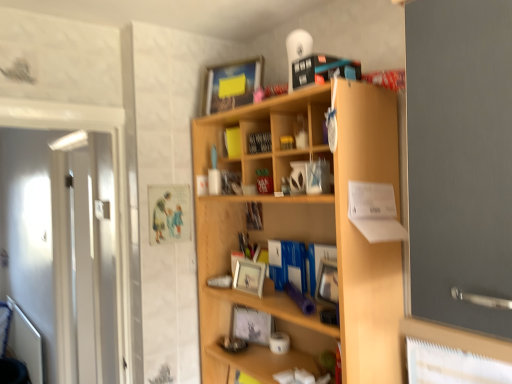
Question: Considering the relative sizes of white glossy door at left and yellow matte book at upper center, marked as the first book in a top-to-bottom arrangement, in the image provided, is white glossy door at left shorter than yellow matte book at upper center, marked as the first book in a top-to-bottom arrangement,?

Choices:
 (A) yes
 (B) no

Answer: (B)

Question: Is white glossy door at left at the right side of yellow matte book at upper center, which appears as the 2th book when viewed from the back?

Choices:
 (A) yes
 (B) no

Answer: (B)

Question: Considering the relative sizes of white glossy door at left and yellow matte book at upper center, the third book positioned from the bottom, in the image provided, is white glossy door at left smaller than yellow matte book at upper center, the third book positioned from the bottom,?

Choices:
 (A) yes
 (B) no

Answer: (B)

Question: Is white glossy door at left further to camera compared to yellow matte book at upper center, which appears as the 2th book when viewed from the back?

Choices:
 (A) yes
 (B) no

Answer: (B)

Question: From a real-world perspective, is white glossy door at left on top of yellow matte book at upper center, arranged as the second book when viewed from the front?

Choices:
 (A) no
 (B) yes

Answer: (A)

Question: Is matte wooden picture frame at upper center, the first picture frame positioned from the top, to the left or to the right of matte silver picture frame at center, which appears as the second picture frame when ordered from the bottom, in the image?

Choices:
 (A) left
 (B) right

Answer: (A)

Question: Looking at their shapes, would you say matte wooden picture frame at upper center, which is counted as the 3th picture frame, starting from the bottom, is wider or thinner than matte silver picture frame at center, which appears as the second picture frame when ordered from the bottom?

Choices:
 (A) wide
 (B) thin

Answer: (B)

Question: From a real-world perspective, relative to matte silver picture frame at center, which appears as the second picture frame when ordered from the bottom, is matte wooden picture frame at upper center, which is counted as the 3th picture frame, starting from the bottom, vertically above or below?

Choices:
 (A) below
 (B) above

Answer: (B)

Question: Is matte wooden picture frame at upper center, the first picture frame positioned from the top, situated inside matte silver picture frame at center, which is the second picture frame from top to bottom, or outside?

Choices:
 (A) outside
 (B) inside

Answer: (A)

Question: From a real-world perspective, is white glossy door at left physically located above or below matte silver picture frame at center, placed as the first picture frame when sorted from bottom to top?

Choices:
 (A) below
 (B) above

Answer: (B)

Question: Does point (59, 188) appear closer or farther from the camera than point (261, 321)?

Choices:
 (A) closer
 (B) farther

Answer: (B)

Question: In the image, is white glossy door at left on the left side or the right side of matte silver picture frame at center, the 3th picture frame when ordered from top to bottom?

Choices:
 (A) left
 (B) right

Answer: (A)

Question: Is white glossy door at left bigger or smaller than matte silver picture frame at center, placed as the first picture frame when sorted from bottom to top?

Choices:
 (A) small
 (B) big

Answer: (B)

Question: Considering their positions, is wooden photo frame at center, acting as the 3th book starting from the top, located in front of or behind yellow matte book at upper center, the third book positioned from the bottom?

Choices:
 (A) behind
 (B) front

Answer: (A)

Question: In the image, is wooden photo frame at center, the 1th book positioned from the back, on the left side or the right side of yellow matte book at upper center, arranged as the second book when viewed from the front?

Choices:
 (A) left
 (B) right

Answer: (B)